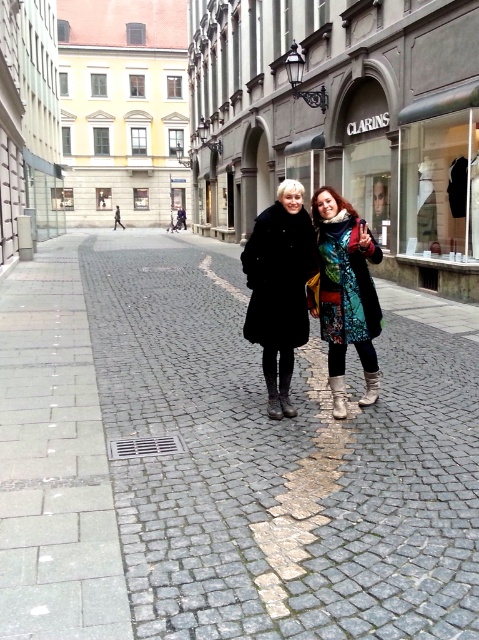
Looking at this image, does matte black coat at center appear under multicolored patchwork coat at center?

Yes.

Between point (272, 262) and point (348, 269), which one is positioned behind?

Positioned behind is point (348, 269).

This screenshot has height=640, width=479. Identify the location of matte black coat at center. (278, 289).

Locate an element on the screen. The height and width of the screenshot is (640, 479). matte black coat at center is located at coordinates (278, 289).

Is the position of gray cobblestone pavement at center more distant than that of matte black coat at center?

No, gray cobblestone pavement at center is closer to the viewer.

Is point (379, 404) in front of point (272, 284)?

That is False.

Which is behind, point (105, 600) or point (276, 342)?

Point (276, 342)

What are the coordinates of `gray cobblestone pavement at center` in the screenshot? It's located at (225, 460).

Does point (141, 445) come in front of point (317, 209)?

Yes, point (141, 445) is in front of point (317, 209).

Who is more forward, (x=372, y=451) or (x=353, y=216)?

Point (x=372, y=451)

Locate an element on the screen. This screenshot has width=479, height=640. gray cobblestone pavement at center is located at coordinates (225, 460).